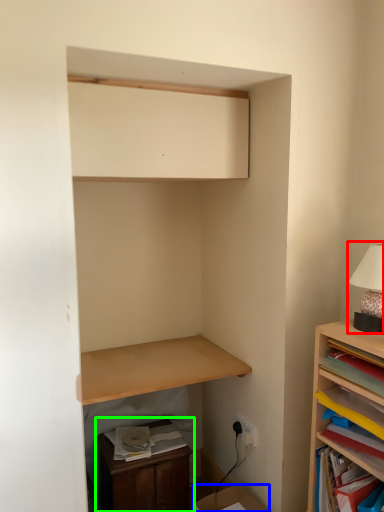
Question: Based on their relative distances, which object is farther from table lamp (highlighted by a red box)? Choose from cardboard box (highlighted by a blue box) and dresser (highlighted by a green box).

Choices:
 (A) cardboard box
 (B) dresser

Answer: (B)